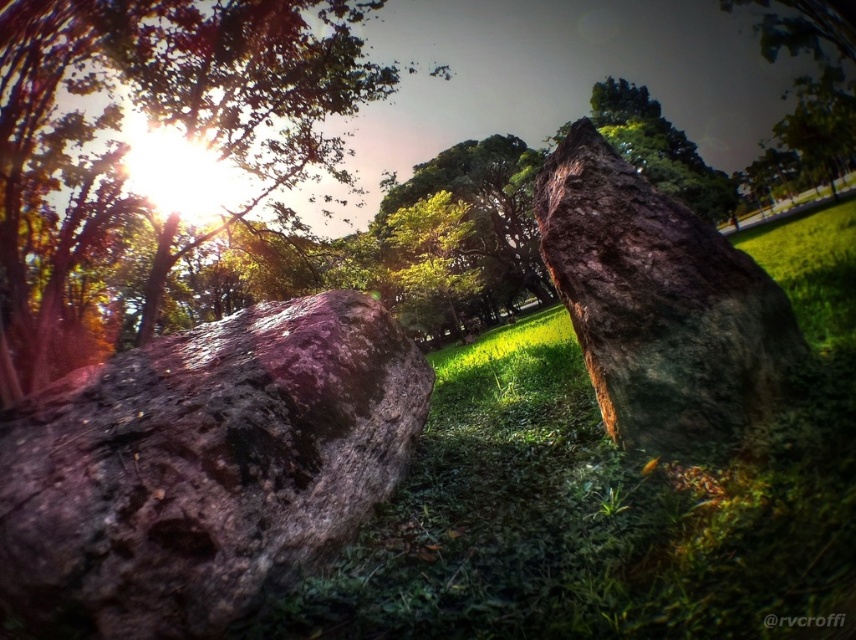
Question: Among these points, which one is farthest from the camera?

Choices:
 (A) tap(782, 145)
 (B) tap(9, 301)

Answer: (A)

Question: Which point is farther to the camera?

Choices:
 (A) green leafy tree at upper center
 (B) green grassy at center
 (C) smooth brown rock at left
 (D) green mossy rock at center

Answer: (A)

Question: Can you confirm if green grassy at center is wider than green mossy rock at center?

Choices:
 (A) yes
 (B) no

Answer: (A)

Question: Does rusty stone boulder at lower left appear under green mossy rock at center?

Choices:
 (A) no
 (B) yes

Answer: (B)

Question: Is rusty stone boulder at lower left thinner than green mossy rock at center?

Choices:
 (A) yes
 (B) no

Answer: (B)

Question: Which object appears farthest from the camera in this image?

Choices:
 (A) green grassy at center
 (B) green leafy tree at upper center
 (C) smooth brown rock at left
 (D) green mossy rock at center

Answer: (B)